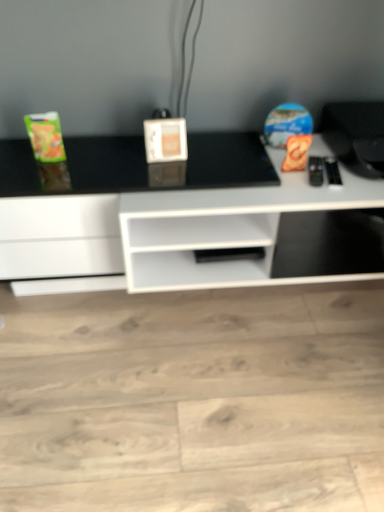
This screenshot has width=384, height=512. In order to click on vacant space situated above white glossy desk at center (from a real-world perspective) in this screenshot , I will do `click(208, 186)`.